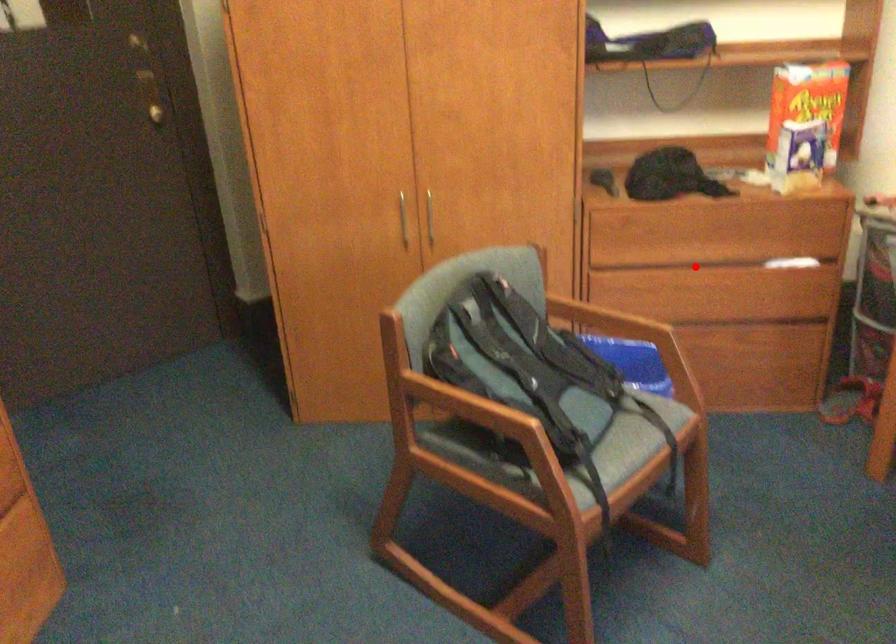
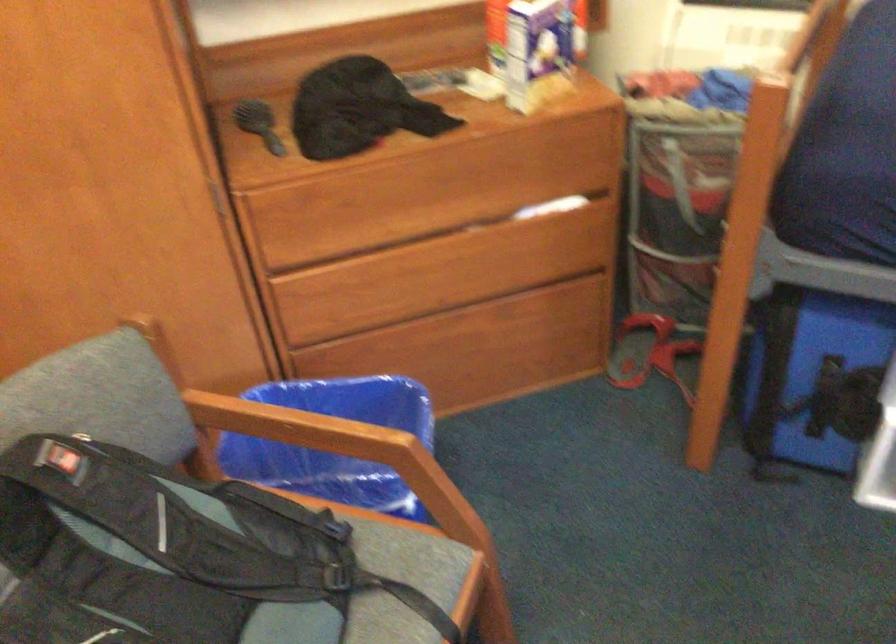
Question: I am providing you with two images of the same scene from different viewpoints. A red point is shown in image1. For the corresponding object point in image2, is it positioned nearer or farther from the camera?

Choices:
 (A) Nearer
 (B) Farther

Answer: (A)